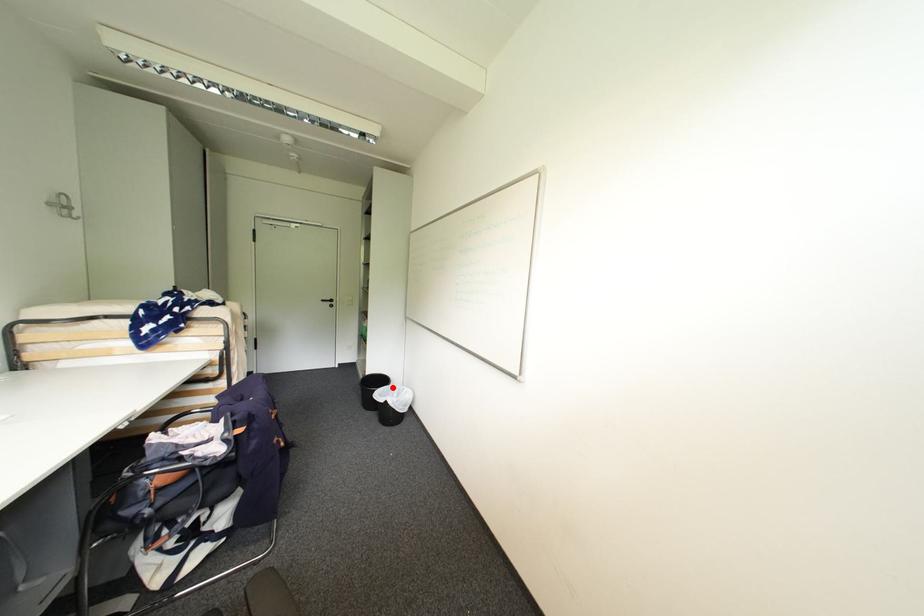
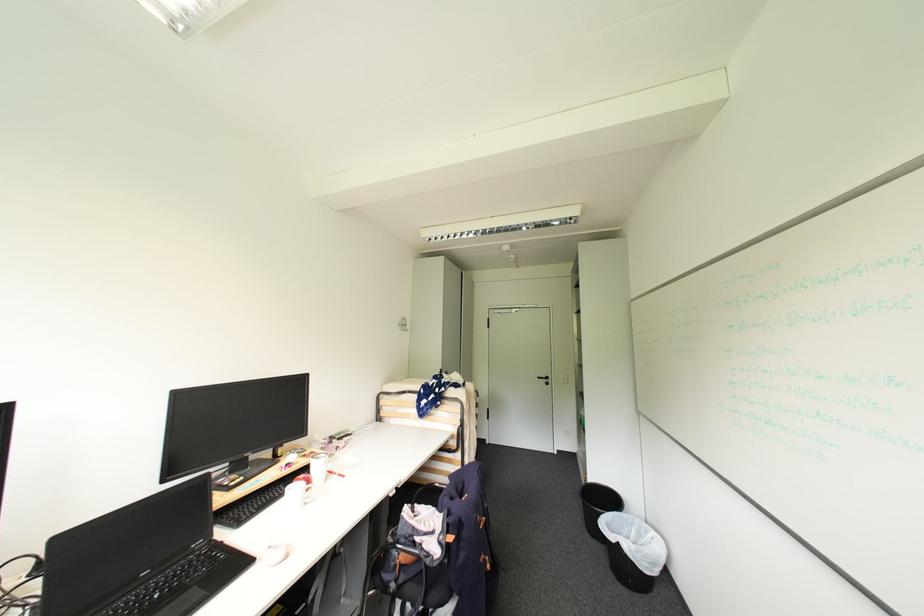
In the second image, find the point that corresponds to the highlighted location in the first image.

(624, 514)